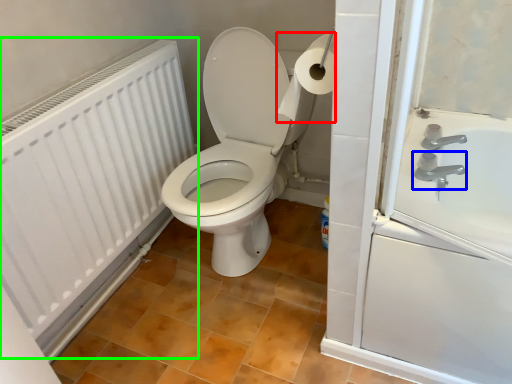
Question: Estimate the real-world distances between objects in this image. Which object is closer to toilet paper (highlighted by a red box), tap (highlighted by a blue box) or radiator (highlighted by a green box)?

Choices:
 (A) tap
 (B) radiator

Answer: (A)